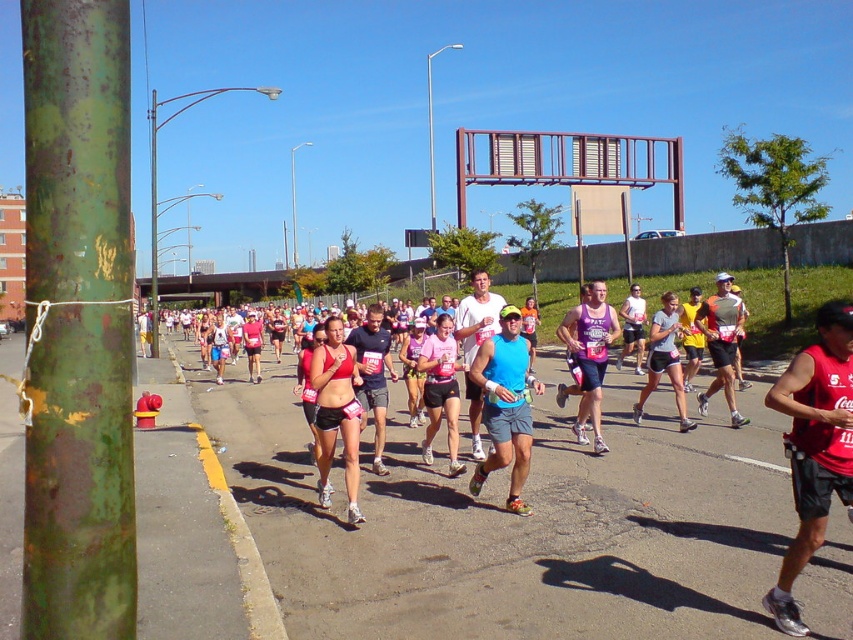
You are a photographer positioned at the starting line of the marathon. You want to capture a photo of the matte red sports bra at center without the green rusted pole at left blocking it. What should you do?

Move to the right side so that the green rusted pole at left is no longer in front of the matte red sports bra at center, as the green rusted pole at left is currently positioned above it and blocking the view.